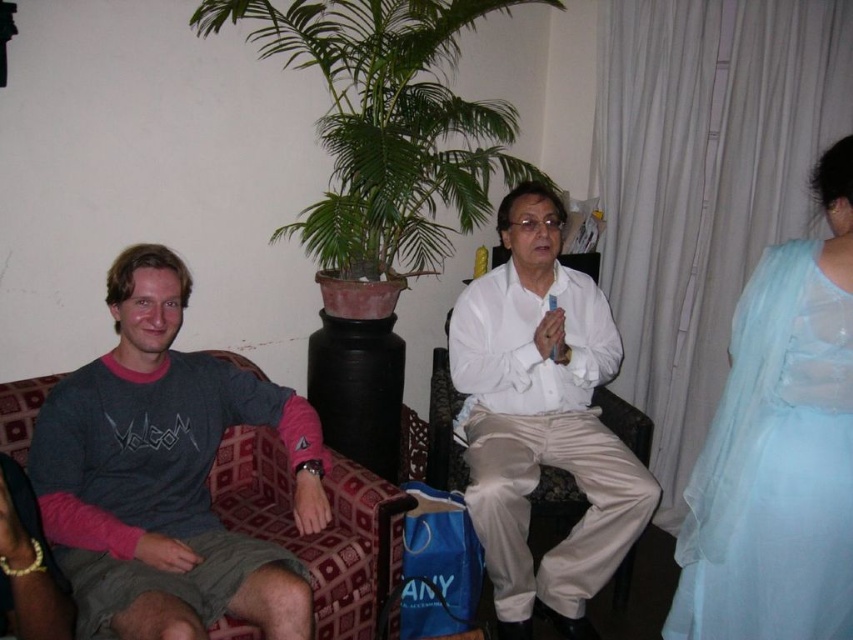
Consider the image. You are a photographer setting up a shoot in this room. You need to position a light source so that it illuminates both the gray cotton shirt at left and the white satin pants at center. Based on their positions, where should you place the light source relative to these two objects?

The gray cotton shirt at left is located below the white satin pants at center. To illuminate both, place the light source above the white satin pants at center so that it can cast light downward onto the gray cotton shirt at left and still reach the white satin pants at center.

You are a tailor who needs to determine which fabric to use for a large project. Based on the image, which object between the gray cotton shirt at left and the light blue sheer fabric at right has a bigger size?

The gray cotton shirt at left has a larger size compared to the light blue sheer fabric at right, so the gray cotton shirt at left is the better choice for a large project.

What are the coordinates of the light blue sheer fabric at right?

The coordinates of the light blue sheer fabric at right are at point (779, 449).